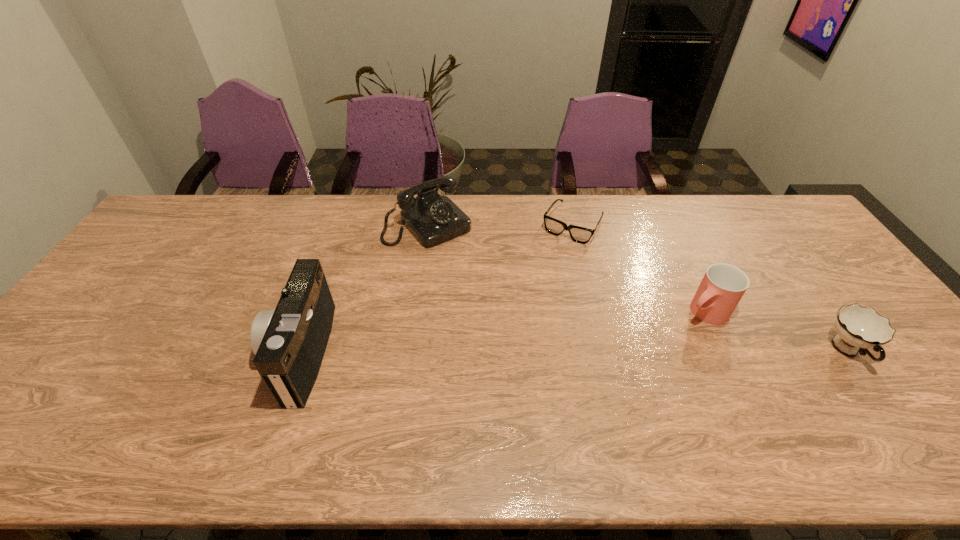
Find the location of a particular element. The width and height of the screenshot is (960, 540). free space between the telephone and the shortest object is located at coordinates (500, 225).

This screenshot has height=540, width=960. Find the location of `vacant space in between the second object from left to right and the rightmost object`. vacant space in between the second object from left to right and the rightmost object is located at coordinates pos(637,288).

This screenshot has height=540, width=960. What are the coordinates of `free point between the camcorder and the fourth object from right to left` in the screenshot? It's located at (364, 289).

Locate an element on the screen. The height and width of the screenshot is (540, 960). free space between the shorter cup and the leftmost object is located at coordinates (574, 352).

Identify the location of unoccupied area between the shortest object and the camcorder. Image resolution: width=960 pixels, height=540 pixels. (436, 289).

The width and height of the screenshot is (960, 540). I want to click on free spot between the leftmost object and the left cup, so (502, 333).

You are a GUI agent. You are given a task and a screenshot of the screen. Output one action in this format:
    pyautogui.click(x=<x>, y=<y>)
    Task: Click on the blank region between the left cup and the sunglasses
    
    Given the screenshot: What is the action you would take?
    pos(638,269)

This screenshot has height=540, width=960. Identify the location of vacant area that lies between the sunglasses and the tallest object. (436, 289).

This screenshot has height=540, width=960. Find the location of `free point between the second shortest object and the second object from left to right`. free point between the second shortest object and the second object from left to right is located at coordinates (637, 288).

Where is `vacant space that's between the second object from right to left and the tallest object`? vacant space that's between the second object from right to left and the tallest object is located at coordinates (502, 333).